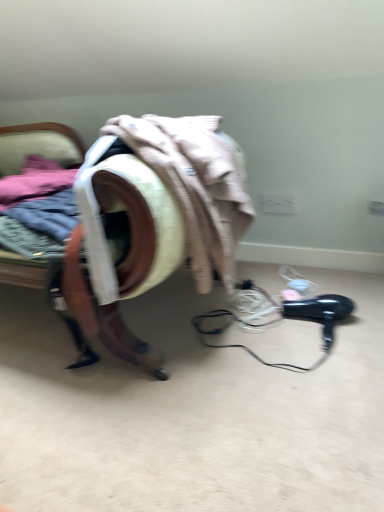
Question: Considering the relative positions of black plastic hair dryer at lower right and velvet-like armchair at center in the image provided, is black plastic hair dryer at lower right in front of velvet-like armchair at center?

Choices:
 (A) no
 (B) yes

Answer: (A)

Question: Is black plastic hair dryer at lower right thinner than velvet-like armchair at center?

Choices:
 (A) no
 (B) yes

Answer: (B)

Question: Considering the relative sizes of black plastic hair dryer at lower right and velvet-like armchair at center in the image provided, is black plastic hair dryer at lower right wider than velvet-like armchair at center?

Choices:
 (A) no
 (B) yes

Answer: (A)

Question: From the image's perspective, is black plastic hair dryer at lower right below velvet-like armchair at center?

Choices:
 (A) no
 (B) yes

Answer: (B)

Question: Is black plastic hair dryer at lower right oriented away from velvet-like armchair at center?

Choices:
 (A) no
 (B) yes

Answer: (A)

Question: Is black plastic hair dryer at lower right outside velvet-like armchair at center?

Choices:
 (A) yes
 (B) no

Answer: (A)

Question: From a real-world perspective, is velvet-like armchair at center located higher than black plastic hair dryer at lower right?

Choices:
 (A) no
 (B) yes

Answer: (B)

Question: Considering the relative sizes of velvet-like armchair at center and black plastic hair dryer at lower right in the image provided, is velvet-like armchair at center thinner than black plastic hair dryer at lower right?

Choices:
 (A) yes
 (B) no

Answer: (B)

Question: From a real-world perspective, is velvet-like armchair at center positioned under black plastic hair dryer at lower right based on gravity?

Choices:
 (A) no
 (B) yes

Answer: (A)

Question: Is velvet-like armchair at center taller than black plastic hair dryer at lower right?

Choices:
 (A) no
 (B) yes

Answer: (B)

Question: Is velvet-like armchair at center facing towards black plastic hair dryer at lower right?

Choices:
 (A) yes
 (B) no

Answer: (B)

Question: Is velvet-like armchair at center looking in the opposite direction of black plastic hair dryer at lower right?

Choices:
 (A) no
 (B) yes

Answer: (A)

Question: Do you think velvet-like armchair at center is within black plastic hair dryer at lower right, or outside of it?

Choices:
 (A) outside
 (B) inside

Answer: (A)